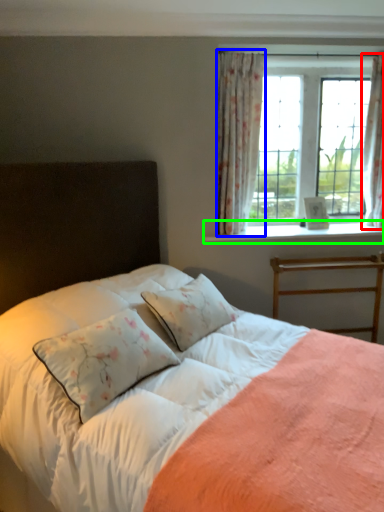
Question: Which is farther away from curtain (highlighted by a red box)? curtain (highlighted by a blue box) or window sill (highlighted by a green box)?

Choices:
 (A) curtain
 (B) window sill

Answer: (A)